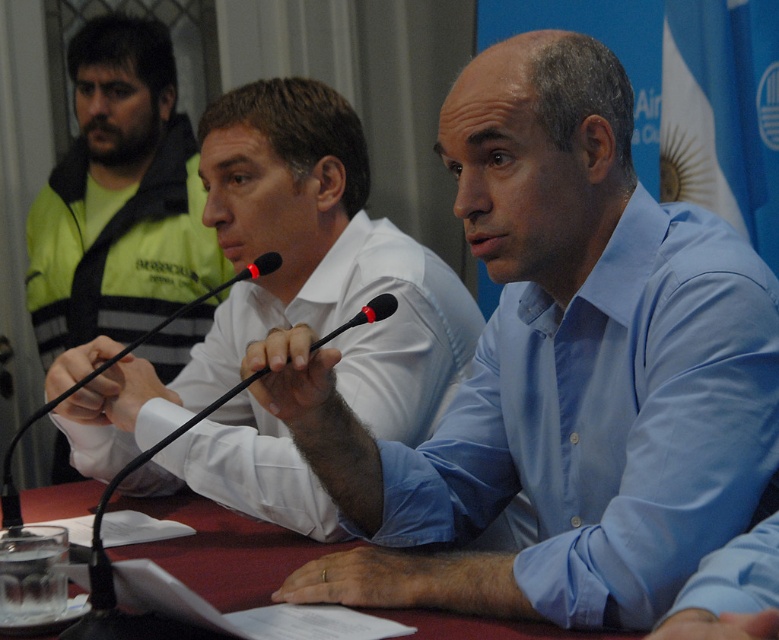
Looking at this image, which is below, light blue shirt at center or black plastic microphone at center?

black plastic microphone at center is below.

Who is positioned more to the left, light blue shirt at center or black plastic microphone at center?

Positioned to the left is black plastic microphone at center.

The height and width of the screenshot is (640, 779). Identify the location of light blue shirt at center. (555, 372).

The image size is (779, 640). What do you see at coordinates (555, 372) in the screenshot? I see `light blue shirt at center` at bounding box center [555, 372].

Is light blue shirt at center thinner than maroon fabric table at center?

Indeed, light blue shirt at center has a lesser width compared to maroon fabric table at center.

Which is behind, point (686, 502) or point (256, 596)?

Point (256, 596)

Locate an element on the screen. This screenshot has height=640, width=779. light blue shirt at center is located at coordinates (555, 372).

Does point (388, 385) lie behind point (12, 524)?

Yes.

In the scene shown: Is white shirt at center in front of black plastic microphone at center?

No, it is behind black plastic microphone at center.

At what (x,y) coordinates should I click in order to perform the action: click on white shirt at center. Please return your answer as a coordinate pair (x, y). Looking at the image, I should click on coord(294,280).